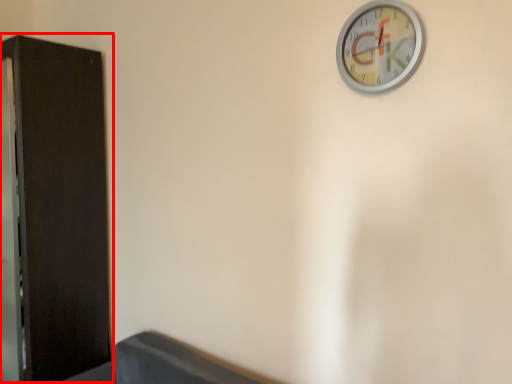
Question: Where is dresser (annotated by the red box) located in relation to wall clock in the image?

Choices:
 (A) left
 (B) right

Answer: (A)